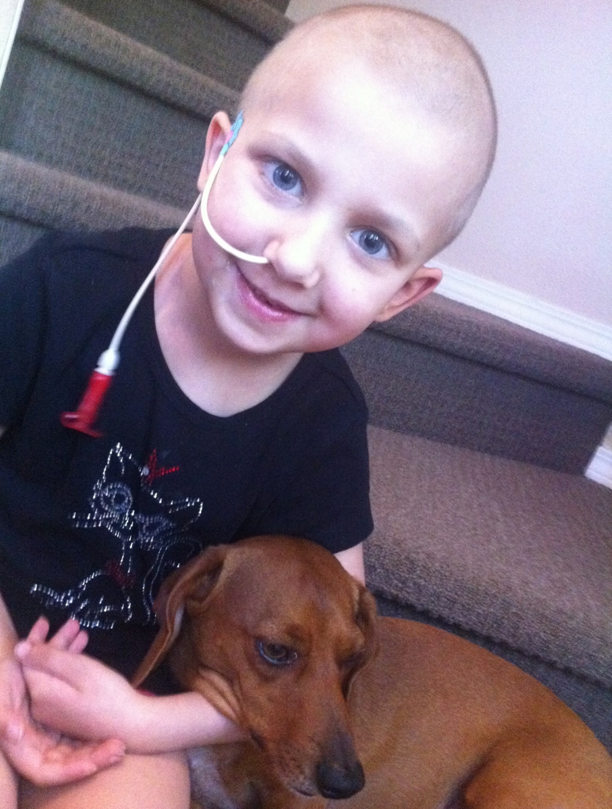
This screenshot has height=809, width=612. In order to click on white cord in this screenshot , I will do `click(215, 227)`.